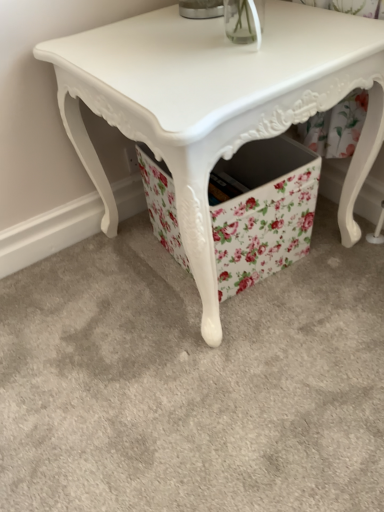
I want to click on free space in front of floral fabric storage box at lower center, so click(x=255, y=331).